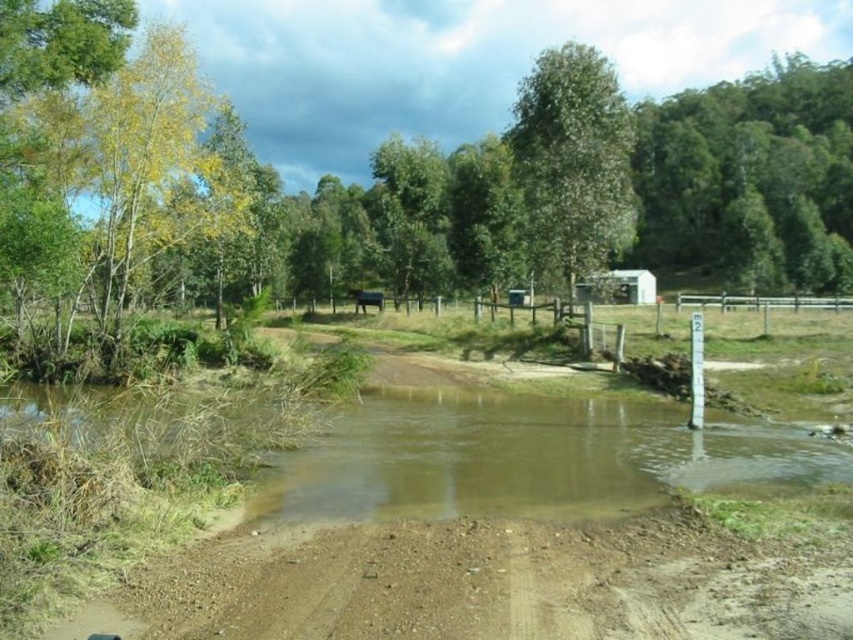
You are a hiker planning to walk from the green leafy tree at upper center to the green leafy trees at upper right. Given that your average walking pace is 3 miles per hour, how many minutes will it take you to reach the destination?

The distance between the green leafy tree at upper center and the green leafy trees at upper right is 196.35 feet. Converting this distance to miles, 196.35 feet is approximately 0.037 miles. At a walking pace of 3 miles per hour, it would take roughly 0.037 divided by 3 equals approximately 0.0123 hours. Multiplying by 60 minutes gives about 0.74 minutes, so roughly 44 seconds. However, since the question asks for minutes, it would be approximately 0.7 minutes or about 44 seconds.